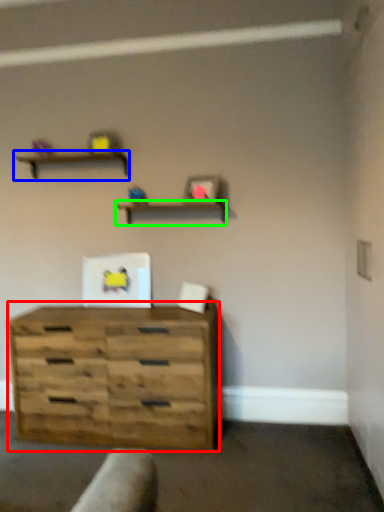
Question: Which is farther away from chest of drawers (highlighted by a red box)? shelf (highlighted by a blue box) or shelf (highlighted by a green box)?

Choices:
 (A) shelf
 (B) shelf

Answer: (A)